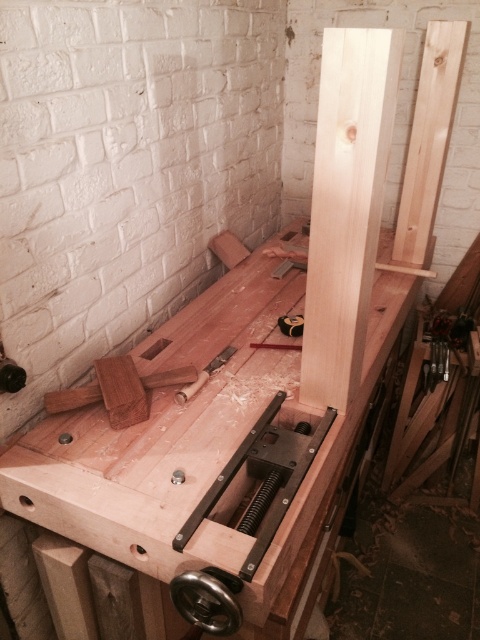
Does natural wood workbench at center have a lesser height compared to natural wood beam at center?

No, natural wood workbench at center is not shorter than natural wood beam at center.

Can you confirm if natural wood workbench at center is thinner than natural wood beam at center?

Incorrect, natural wood workbench at center's width is not less than natural wood beam at center's.

Which is in front, point (371, 333) or point (362, 208)?

Point (362, 208) is in front.

You are a GUI agent. You are given a task and a screenshot of the screen. Output one action in this format:
    pyautogui.click(x=<x>, y=<y>)
    Task: Click on the natural wood workbench at center
    The width and height of the screenshot is (480, 640).
    Given the screenshot: What is the action you would take?
    pyautogui.click(x=204, y=449)

Does natural wood workbench at center come in front of wooden handle at center?

Yes, it is.

Can you confirm if natural wood workbench at center is wider than wooden handle at center?

Indeed, natural wood workbench at center has a greater width compared to wooden handle at center.

Locate an element on the screen. The width and height of the screenshot is (480, 640). natural wood workbench at center is located at coordinates (204, 449).

Image resolution: width=480 pixels, height=640 pixels. What are the coordinates of `natural wood workbench at center` in the screenshot? It's located at (204, 449).

Which is more to the right, natural wood beam at center or wooden handle at center?

natural wood beam at center

Locate an element on the screen. natural wood beam at center is located at coordinates (347, 205).

Where is `natural wood beam at center`? natural wood beam at center is located at coordinates (347, 205).